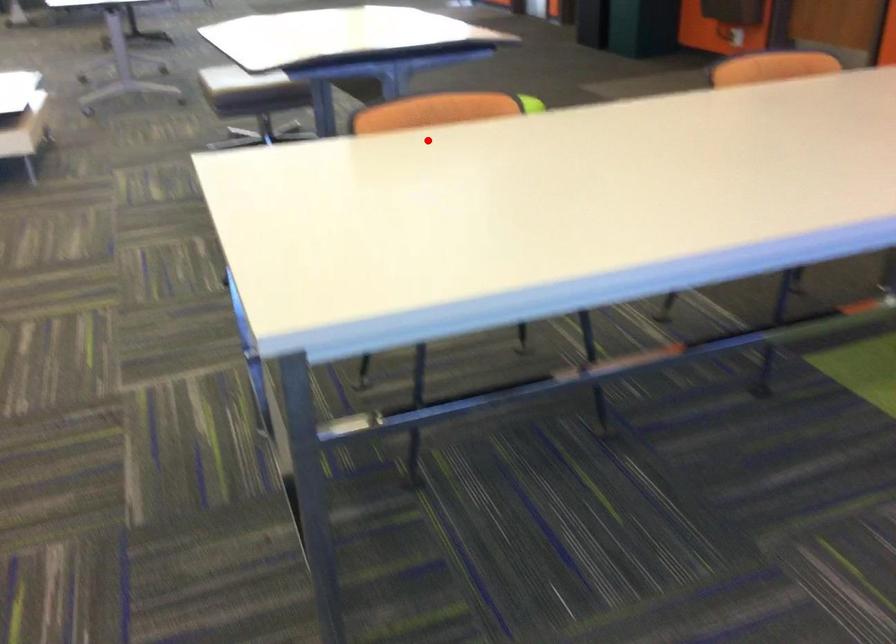
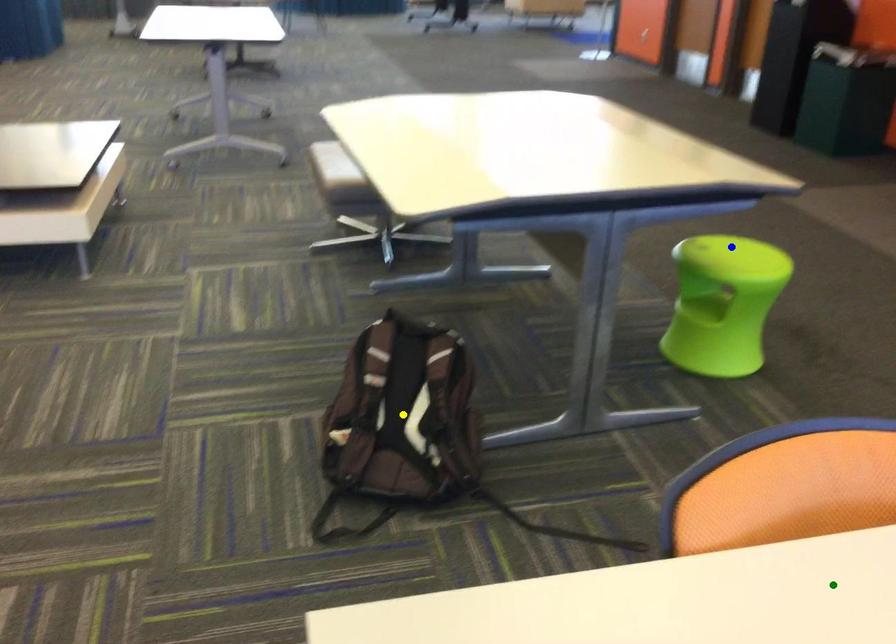
Question: I am providing you with two images of the same scene from different viewpoints. A red point is marked on the first image. You are given multiple points on the second image. Can you choose the point in image 2 that corresponds to the point in image 1?

Choices:
 (A) green point
 (B) blue point
 (C) yellow point

Answer: (A)